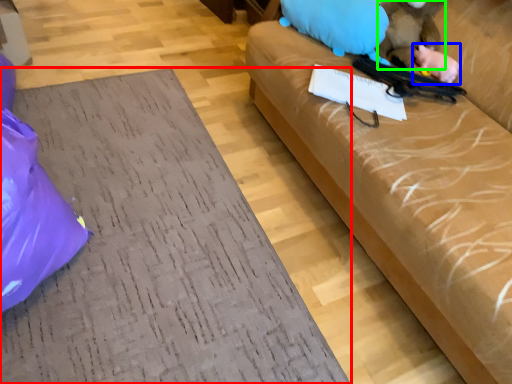
Question: Considering the real-world distances, which object is farthest from furniture (highlighted by a red box)? animal (highlighted by a blue box) or animal (highlighted by a green box)?

Choices:
 (A) animal
 (B) animal

Answer: (A)